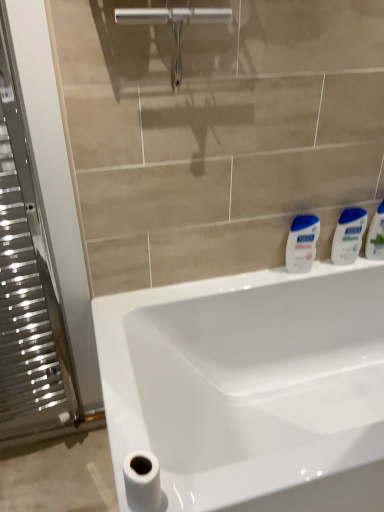
Find the location of a particular element. vacant area that is situated to the right of white matte toilet paper at lower left is located at coordinates (x=217, y=486).